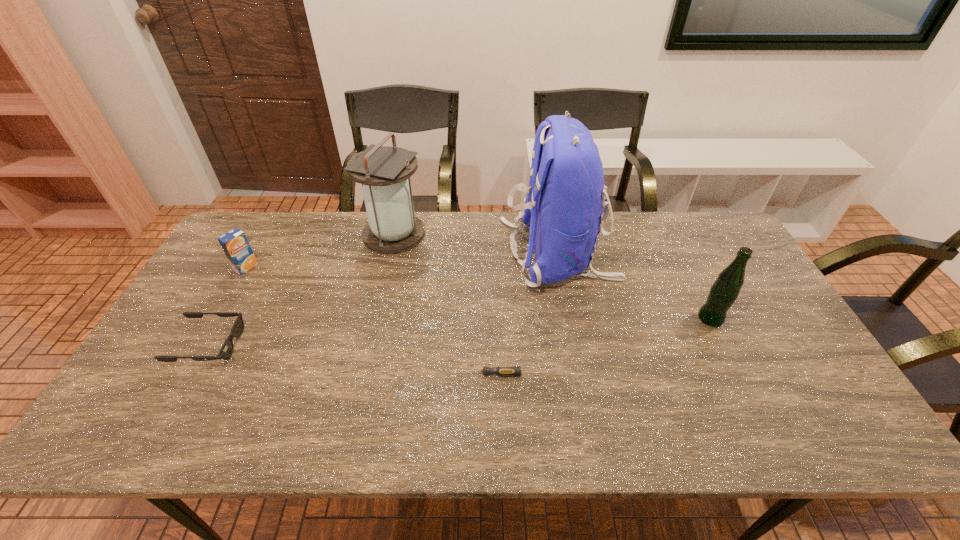
What are the coordinates of `free location that satisfies the following two spatial constraints: 1. on the front side of the third tallest object; 2. on the temples of the sunglasses` in the screenshot? It's located at (723, 345).